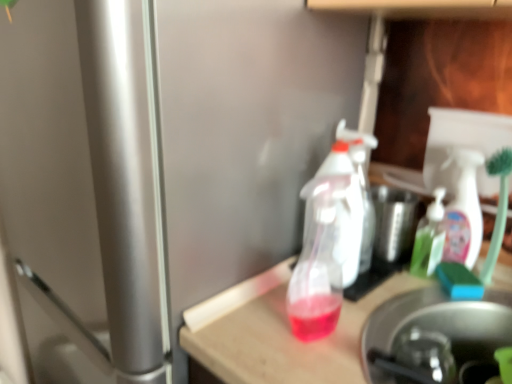
Identify the location of vacant space behind translucent plastic spray bottle at center, the 1th bottle when ordered from left to right. The width and height of the screenshot is (512, 384). (333, 292).